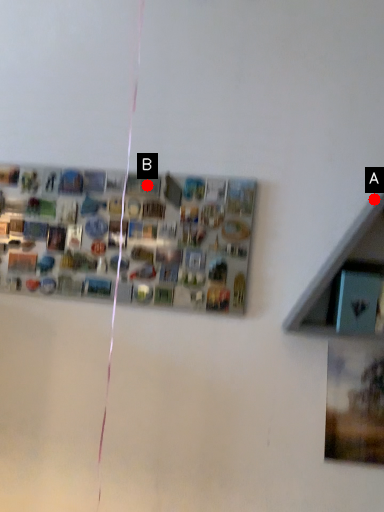
Question: Two points are circled on the image, labeled by A and B beside each circle. Which point is farther to the camera?

Choices:
 (A) A is further
 (B) B is further

Answer: (B)